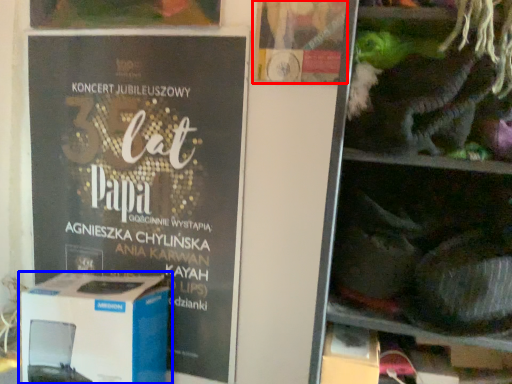
Question: Among these objects, which one is nearest to the camera, flyer (highlighted by a red box) or box (highlighted by a blue box)?

Choices:
 (A) flyer
 (B) box

Answer: (A)